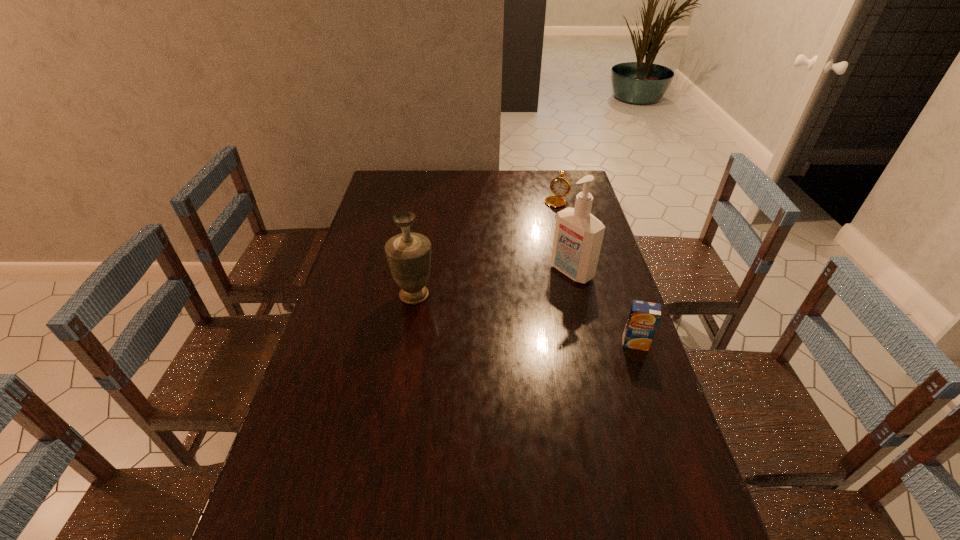
Where is `free location located on the face of the shortest object`? This screenshot has height=540, width=960. free location located on the face of the shortest object is located at coordinates (517, 267).

At what (x,y) coordinates should I click in order to perform the action: click on vacant space situated 0.180m on the front label of the cleansing agent. Please return your answer as a coordinate pair (x, y). Looking at the image, I should click on (518, 306).

This screenshot has height=540, width=960. I want to click on vacant space located 0.200m on the front label of the cleansing agent, so tap(514, 309).

Find the location of a particular element. This screenshot has height=540, width=960. vacant position located 0.250m on the front label of the cleansing agent is located at coordinates (502, 316).

This screenshot has height=540, width=960. Identify the location of object that is at the far edge. (559, 186).

Find the location of a particular element. This screenshot has height=540, width=960. orange_juice at the right edge is located at coordinates (644, 317).

Identify the location of pocket watch at the right edge. (559, 186).

At what (x,y) coordinates should I click in order to perform the action: click on cleansing agent present at the right edge. Please return your answer as a coordinate pair (x, y). The image size is (960, 540). Looking at the image, I should click on (578, 237).

Find the location of `object located in the far right corner section of the desktop`. object located in the far right corner section of the desktop is located at coordinates (559, 186).

Identify the location of free space at the far edge of the desktop. This screenshot has height=540, width=960. (539, 178).